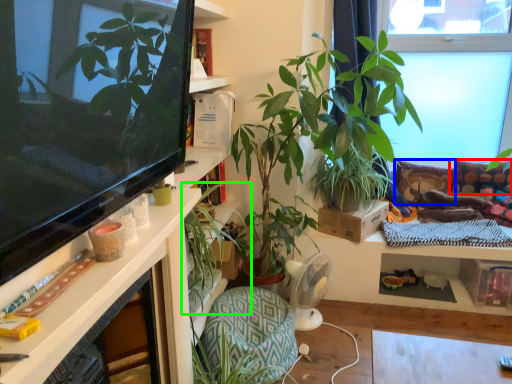
Question: Which is farther away from pillow (highlighted by a red box)? pillow (highlighted by a blue box) or houseplant (highlighted by a green box)?

Choices:
 (A) pillow
 (B) houseplant

Answer: (B)